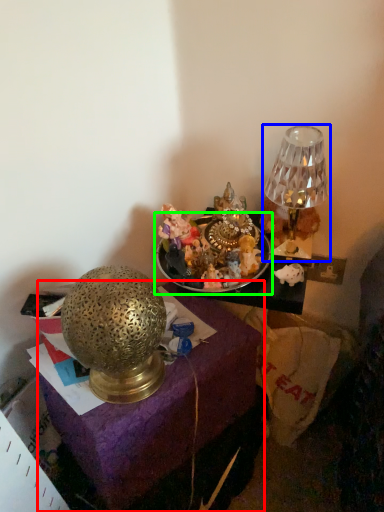
Question: Estimate the real-world distances between objects in this image. Which object is closer to furniture (highlighted by a red box), lamp (highlighted by a blue box) or tableware (highlighted by a green box)?

Choices:
 (A) lamp
 (B) tableware

Answer: (B)